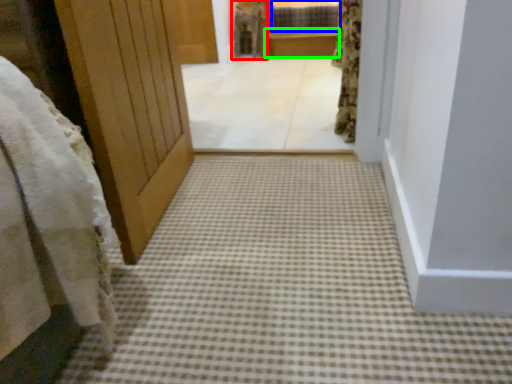
Question: Estimate the real-world distances between objects in this image. Which object is closer to robe (highlighted by a red box), window (highlighted by a blue box) or balustrade (highlighted by a green box)?

Choices:
 (A) window
 (B) balustrade

Answer: (B)